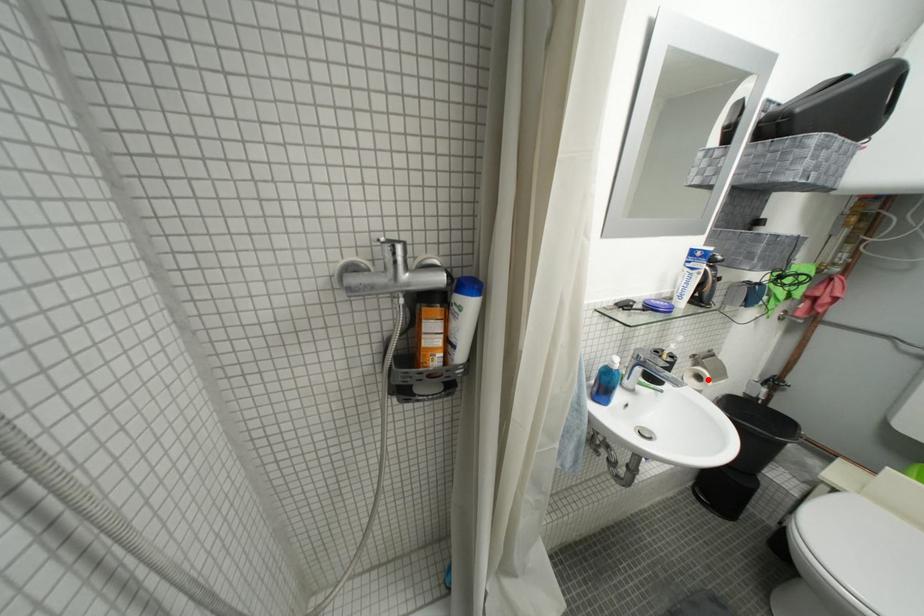
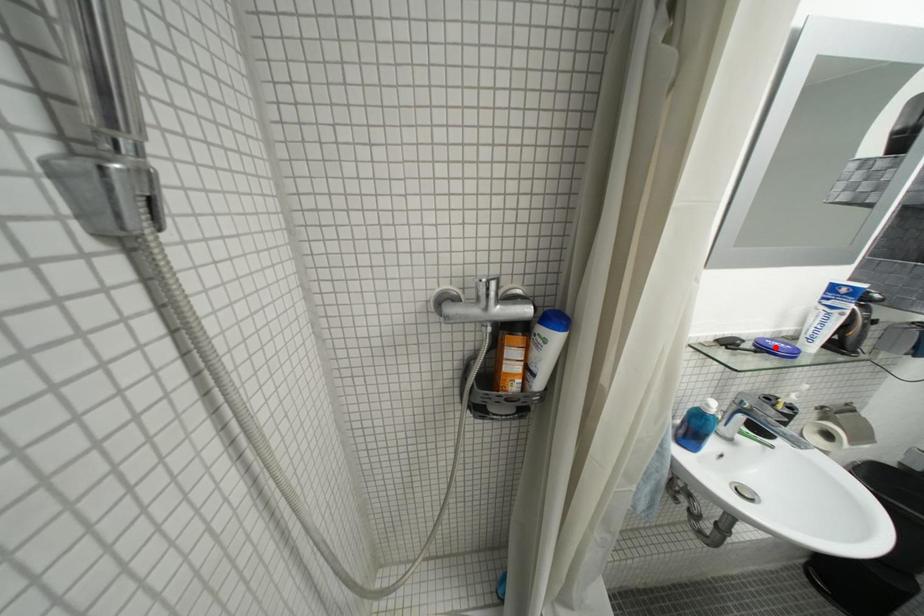
I am providing you with two images of the same scene from different viewpoints. A red point is marked on the first image and another point is marked on the second image. Does the point marked in image1 correspond to the same location as the one in image2?

No